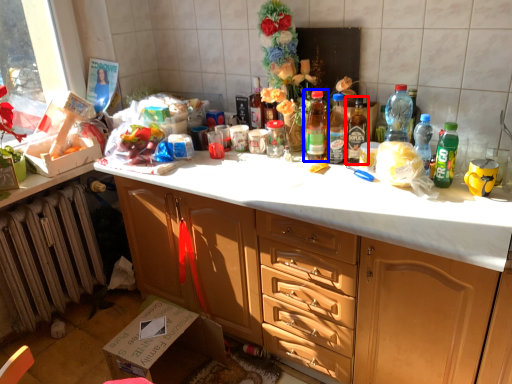
Question: Which object appears farthest to the camera in this image, bottle (highlighted by a red box) or bottle (highlighted by a blue box)?

Choices:
 (A) bottle
 (B) bottle

Answer: (B)